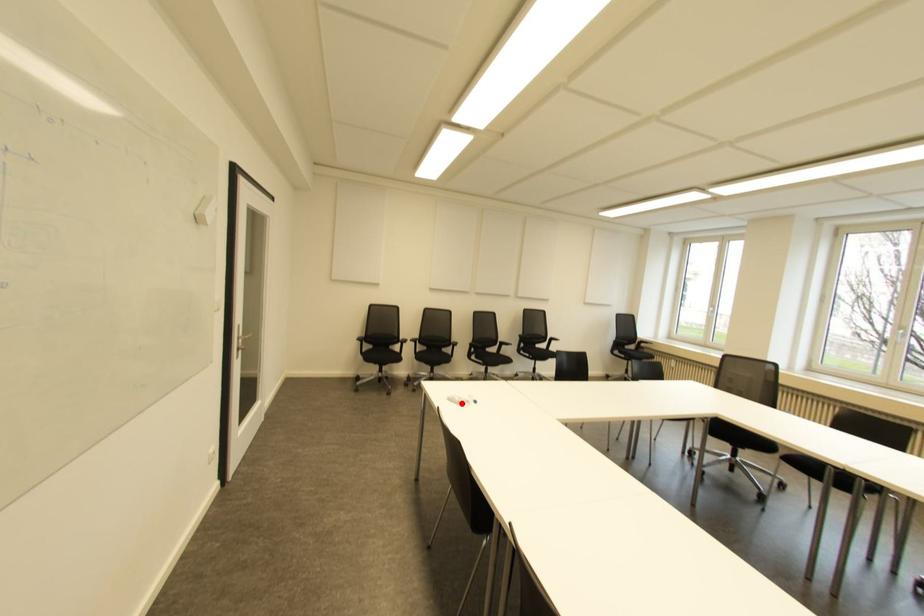
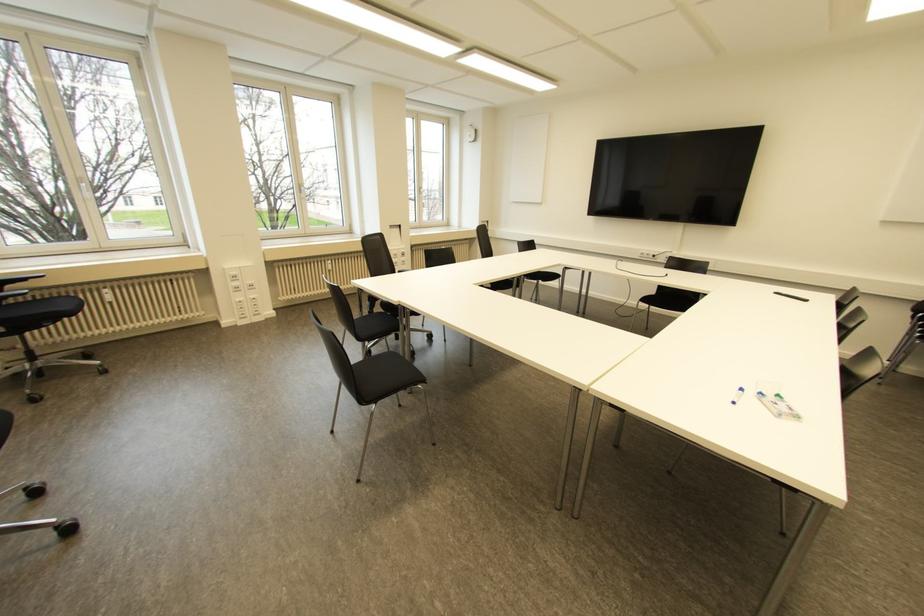
Question: A red point is marked in image1. In image2, is the corresponding 3D point closer to the camera or farther? Reply with the corresponding letter.

Choices:
 (A) The corresponding 3D point is closer.
 (B) The corresponding 3D point is farther.

Answer: (B)